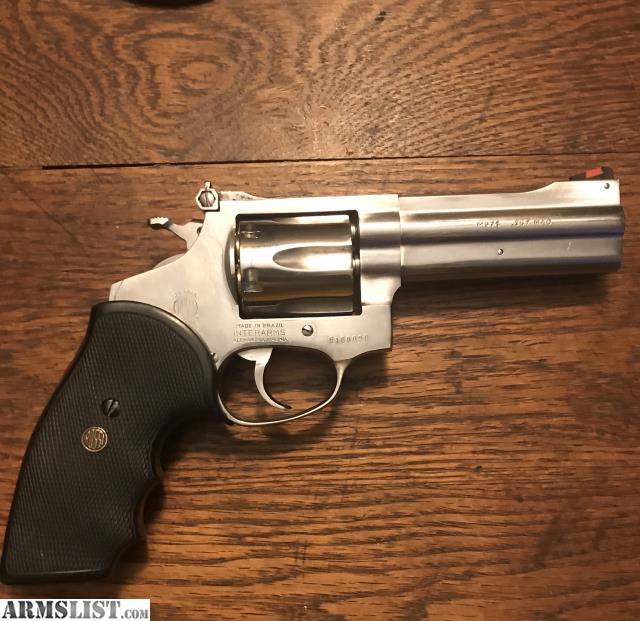
Identify the location of wooden table. (509, 404).